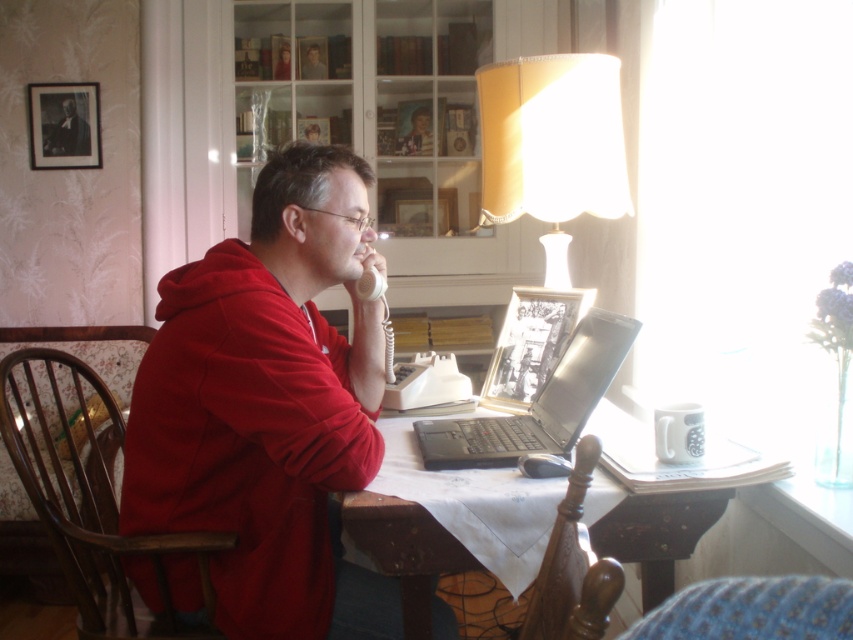
Question: Among these objects, which one is farthest from the camera?

Choices:
 (A) white cloth-covered table at center
 (B) smooth red hoodie at center

Answer: (B)

Question: Does yellow fabric lampshade at upper right come behind smooth red hoodie at center?

Choices:
 (A) yes
 (B) no

Answer: (B)

Question: Can you confirm if white cloth-covered table at center is positioned to the right of smooth skin face at upper center?

Choices:
 (A) no
 (B) yes

Answer: (B)

Question: From the image, what is the correct spatial relationship of silver metallic laptop at center in relation to smooth red hoodie at center?

Choices:
 (A) left
 (B) right

Answer: (B)

Question: Which point is farther to the camera?

Choices:
 (A) (653, 604)
 (B) (68, 99)

Answer: (B)

Question: Which is nearer to the smooth red hoodie at center?

Choices:
 (A) silver metallic laptop at center
 (B) yellow fabric lampshade at upper right
 (C) matte red hoodie at center
 (D) white cloth-covered table at center

Answer: (B)